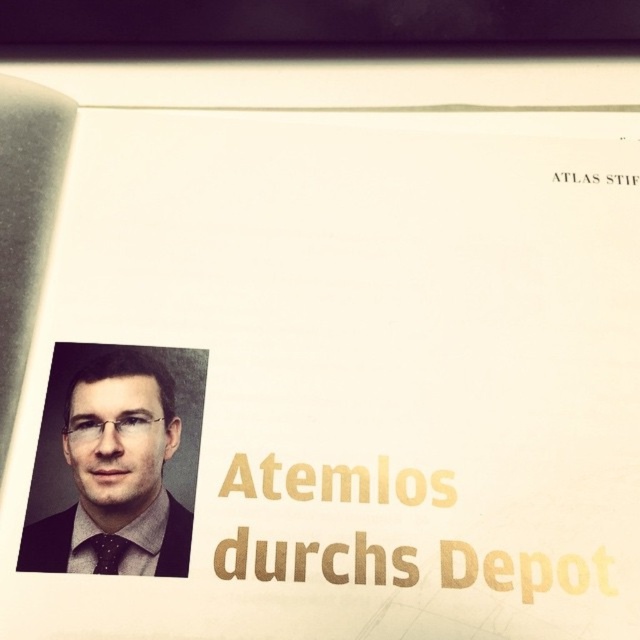
Question: Can you confirm if matte black suit at left is positioned above black dotted tie at lower left?

Choices:
 (A) no
 (B) yes

Answer: (B)

Question: Which point is farther to the camera?

Choices:
 (A) matte black suit at left
 (B) black dotted tie at lower left

Answer: (B)

Question: Is matte black suit at left positioned in front of black dotted tie at lower left?

Choices:
 (A) no
 (B) yes

Answer: (B)

Question: Among these points, which one is nearest to the camera?

Choices:
 (A) (112, 548)
 (B) (124, 556)

Answer: (B)

Question: Which object is farther from the camera taking this photo?

Choices:
 (A) black dotted tie at lower left
 (B) matte black suit at left

Answer: (A)

Question: Is matte black suit at left to the left of black dotted tie at lower left from the viewer's perspective?

Choices:
 (A) yes
 (B) no

Answer: (A)